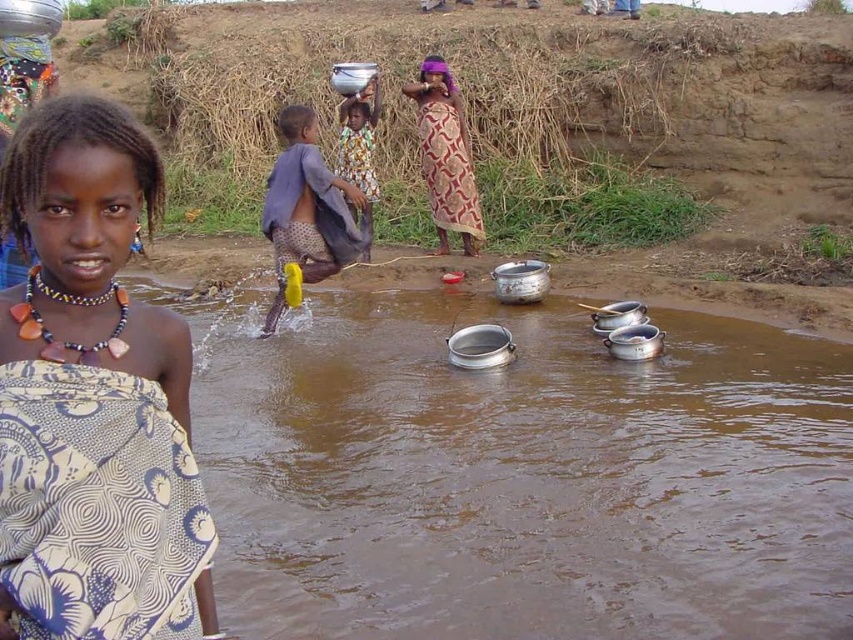
From the picture: Based on the scene description, can you determine if the patterned fabric dress at center is located below the metallic silver pot at upper center?

Yes, the patterned fabric dress at center is positioned under the metallic silver pot at upper center according to the description.

You are a photographer trying to capture a photo of the brown metallic pots at center and the yellow fabric cloth at center. If you want to ensure both objects are fully visible in your shot, which object should you focus on first considering their widths?

The brown metallic pots at center might be wider than yellow fabric cloth at center, so focusing on the wider object first would ensure both are fully visible.

You are a photographer trying to capture a photo of the brown metallic pots at center and the yellow fabric cloth at center. Which object should you focus on first if you want to ensure both are in focus, considering their heights?

The brown metallic pots at center is not as tall as yellow fabric cloth at center, so you should focus on the taller yellow fabric cloth at center first to ensure both are in focus.